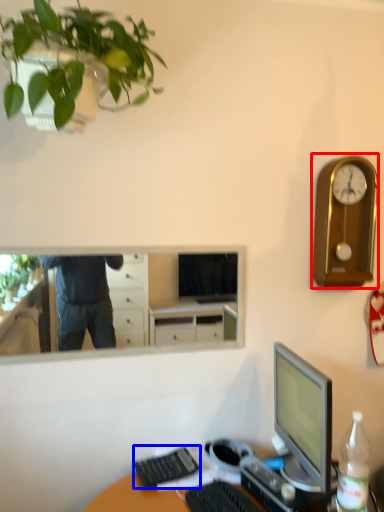
Question: Which of the following is the closest to the observer, clock (highlighted by a red box) or computer keyboard (highlighted by a blue box)?

Choices:
 (A) clock
 (B) computer keyboard

Answer: (B)